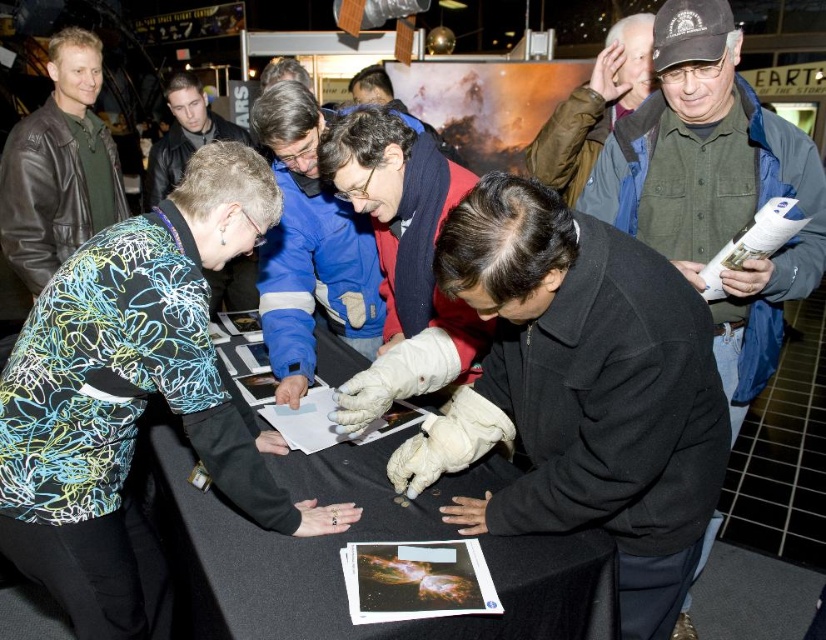
You are standing at the camera position and want to pick up the object at point (563, 627). Can you reach it without moving your feet?

The distance between you and the object at point (563, 627) is 1.33 meters. Since the average human arm length is about 0.7 meters, you cannot reach it without moving your feet.

You are an event organizer at the Mars exhibition and need to determine if the black fabric table at center can fit under a 1.5 meter high display panel. Given the height of the brown leather jacket at upper right, can you estimate if the table will fit?

The black fabric table at center is shorter than the brown leather jacket at upper right. Since the jacket is positioned at upper right and the display panel is 1.5 meters high, if the jacket is taller than the table, the table should fit under the display panel provided the jacket itself is under 1.5 meters. However, without the exact height of the jacket, we can only infer the table is shorter than the jacket, not the panel. Further measurements are needed.